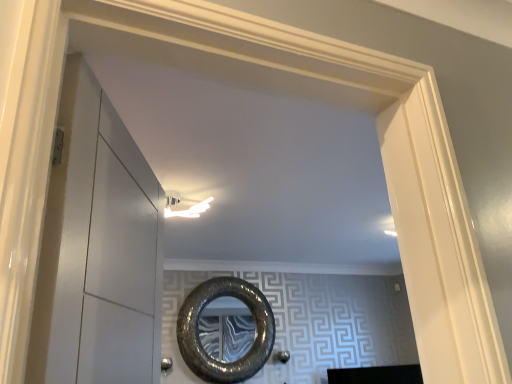
Locate an element on the screen. The height and width of the screenshot is (384, 512). polished silver door handle at lower center is located at coordinates (166, 365).

Where is `shiny metallic mirror at center`? This screenshot has width=512, height=384. shiny metallic mirror at center is located at coordinates (x=198, y=333).

What is the approximate height of transparent glass door at left?

transparent glass door at left is 28.77 inches tall.

Locate an element on the screen. The image size is (512, 384). transparent glass door at left is located at coordinates (97, 250).

Identify the location of polished silver door handle at lower center. Image resolution: width=512 pixels, height=384 pixels. (166, 365).

The height and width of the screenshot is (384, 512). Find the location of `door handle that appears below the shiny metallic mirror at center (from the image's perspective)`. door handle that appears below the shiny metallic mirror at center (from the image's perspective) is located at coordinates (166, 365).

Choose the correct answer: Is shiny metallic mirror at center inside polished silver door handle at lower center or outside it?

shiny metallic mirror at center lies outside polished silver door handle at lower center.

Considering the sizes of objects shiny metallic mirror at center and polished silver door handle at lower center in the image provided, who is thinner, shiny metallic mirror at center or polished silver door handle at lower center?

Thinner between the two is polished silver door handle at lower center.

Can you confirm if shiny metallic mirror at center is shorter than polished silver door handle at lower center?

Incorrect, the height of shiny metallic mirror at center does not fall short of that of polished silver door handle at lower center.

Is polished silver door handle at lower center not near shiny metallic mirror at center?

No, polished silver door handle at lower center is not far away from shiny metallic mirror at center.

Is polished silver door handle at lower center looking in the opposite direction of shiny metallic mirror at center?

polished silver door handle at lower center is not turned away from shiny metallic mirror at center.

From a real-world perspective, who is located lower, polished silver door handle at lower center or shiny metallic mirror at center?

polished silver door handle at lower center is physically lower.

Which of these two, polished silver door handle at lower center or shiny metallic mirror at center, is thinner?

polished silver door handle at lower center.

In the scene shown: Which point is more distant from viewer, (105, 228) or (256, 319)?

Positioned behind is point (256, 319).

Who is smaller, transparent glass door at left or shiny metallic mirror at center?

With smaller size is transparent glass door at left.

Is transparent glass door at left taller than shiny metallic mirror at center?

No.

From the picture: Is transparent glass door at left placed right next to shiny metallic mirror at center?

There is a gap between transparent glass door at left and shiny metallic mirror at center.

Is the position of transparent glass door at left less distant than that of polished silver door handle at lower center?

Yes, transparent glass door at left is closer to the camera.

Is transparent glass door at left taller than polished silver door handle at lower center?

Yes.

Looking at this image, is there a large distance between transparent glass door at left and polished silver door handle at lower center?

Absolutely, transparent glass door at left is distant from polished silver door handle at lower center.

From the image's perspective, is transparent glass door at left below polished silver door handle at lower center?

No, from the image's perspective, transparent glass door at left is not below polished silver door handle at lower center.

Is polished silver door handle at lower center outside of transparent glass door at left?

Yes.

Is polished silver door handle at lower center oriented away from transparent glass door at left?

No, polished silver door handle at lower center is not facing the opposite direction of transparent glass door at left.

How distant is polished silver door handle at lower center from transparent glass door at left?

The distance of polished silver door handle at lower center from transparent glass door at left is 9.70 feet.

Can you tell me how much shiny metallic mirror at center and transparent glass door at left differ in facing direction?

67.1 degrees.

In the scene shown: From a real-world perspective, is shiny metallic mirror at center physically above transparent glass door at left?

Indeed, from a real-world perspective, shiny metallic mirror at center stands above transparent glass door at left.

Considering the sizes of shiny metallic mirror at center and transparent glass door at left in the image, is shiny metallic mirror at center wider or thinner than transparent glass door at left?

shiny metallic mirror at center is thinner than transparent glass door at left.

You are a GUI agent. You are given a task and a screenshot of the screen. Output one action in this format:
    pyautogui.click(x=<x>, y=<y>)
    Task: Click on the door handle in front of the shiny metallic mirror at center
    
    Given the screenshot: What is the action you would take?
    pyautogui.click(x=166, y=365)

Locate an element on the screen. The height and width of the screenshot is (384, 512). door handle below the shiny metallic mirror at center (from a real-world perspective) is located at coordinates (166, 365).

Based on their spatial positions, is transparent glass door at left or polished silver door handle at lower center closer to shiny metallic mirror at center?

Based on the image, polished silver door handle at lower center appears to be nearer to shiny metallic mirror at center.

Estimate the real-world distances between objects in this image. Which object is closer to shiny metallic mirror at center, polished silver door handle at lower center or transparent glass door at left?

Among the two, polished silver door handle at lower center is located nearer to shiny metallic mirror at center.

Looking at the image, which one is located closer to polished silver door handle at lower center, shiny metallic mirror at center or transparent glass door at left?

shiny metallic mirror at center is closer to polished silver door handle at lower center.

Based on their spatial positions, is transparent glass door at left or shiny metallic mirror at center closer to polished silver door handle at lower center?

Based on the image, shiny metallic mirror at center appears to be nearer to polished silver door handle at lower center.

Estimate the real-world distances between objects in this image. Which object is further from transparent glass door at left, polished silver door handle at lower center or shiny metallic mirror at center?

Based on the image, polished silver door handle at lower center appears to be further to transparent glass door at left.

Looking at the image, which one is located closer to transparent glass door at left, shiny metallic mirror at center or polished silver door handle at lower center?

shiny metallic mirror at center is closer to transparent glass door at left.

Where is `door handle positioned between transparent glass door at left and shiny metallic mirror at center from near to far`? door handle positioned between transparent glass door at left and shiny metallic mirror at center from near to far is located at coordinates (166, 365).